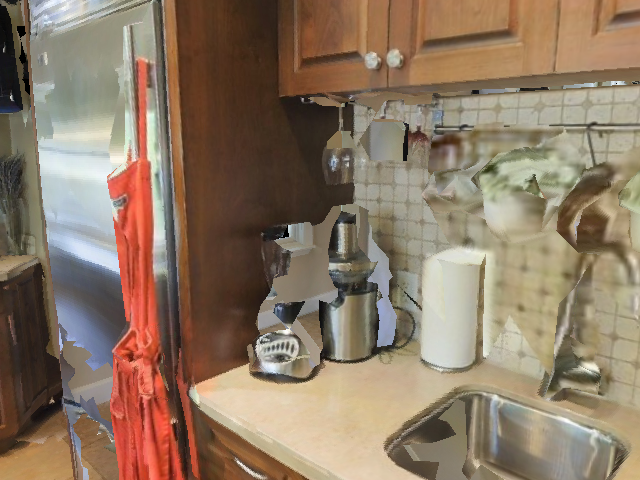
You are a GUI agent. You are given a task and a screenshot of the screen. Output one action in this format:
    pyautogui.click(x=<x>, y=<y>)
    Task: Click on the drawer
    
    Given the screenshot: What is the action you would take?
    (x=251, y=470)